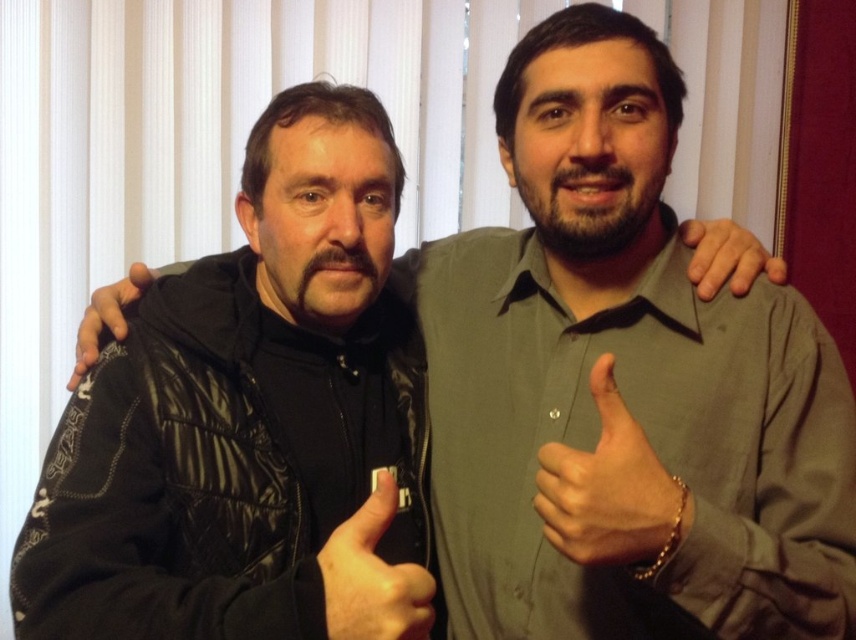
You are taking a photo of two friends. You notice the matte black thumb at center and the black quilted jacket at left in the frame. Which object appears closer to the camera?

The matte black thumb at center appears closer to the camera because it is in front of the black quilted jacket at left.

You are a photographer setting up for a group photo. You notice a smooth skin hand at center and a leather jacket at left in the frame. To ensure both are visible clearly, which object should you adjust your focus on first, considering their sizes?

The smooth skin hand at center is thinner than the leather jacket at left, so you should focus on the leather jacket at left first since it is larger and might require more precise adjustment to ensure clarity.

You are a photographer setting up for a group photo. You need to ensure that the black quilted jacket at left and the matte black thumb at center are at least 12 inches apart to avoid blurring during the shot. Based on the scene description, will their current positions meet this requirement?

The distance between the black quilted jacket at left and the matte black thumb at center is 11.05 inches, which is less than the required 12 inches. Therefore, their current positions do not meet the requirement, and they need to adjust their spacing to ensure clarity in the photograph.